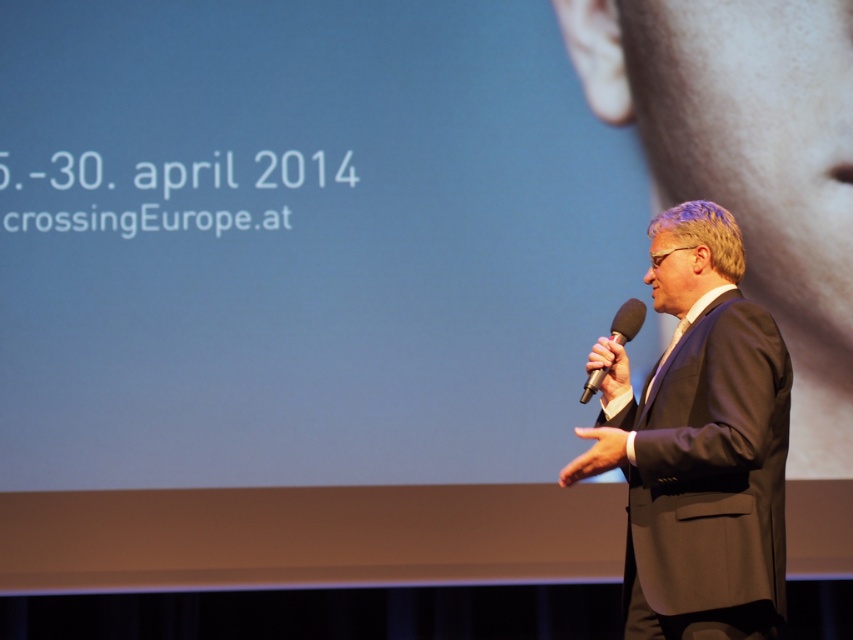
Question: Which point appears farthest from the camera in this image?

Choices:
 (A) (611, 332)
 (B) (701, 404)

Answer: (A)

Question: Among these objects, which one is farthest from the camera?

Choices:
 (A) black matte microphone at right
 (B) matte black suit at right

Answer: (A)

Question: Can you confirm if matte black suit at right is thinner than black matte microphone at right?

Choices:
 (A) no
 (B) yes

Answer: (A)

Question: Which object is farther from the camera taking this photo?

Choices:
 (A) matte black suit at right
 (B) black matte microphone at right

Answer: (B)

Question: Is matte black suit at right to the left of black matte microphone at right from the viewer's perspective?

Choices:
 (A) yes
 (B) no

Answer: (B)

Question: Does matte black suit at right lie in front of black matte microphone at right?

Choices:
 (A) yes
 (B) no

Answer: (A)